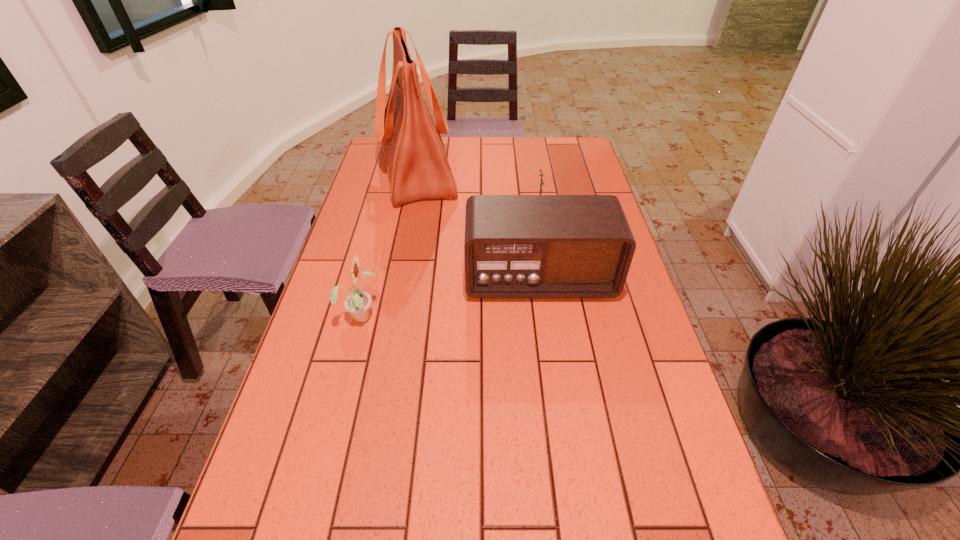
In the image, there is a desktop. Identify the location of free space at the far left corner. Image resolution: width=960 pixels, height=540 pixels. (379, 152).

This screenshot has height=540, width=960. I want to click on free spot between the shopping bag and the left sunflower, so click(389, 243).

The width and height of the screenshot is (960, 540). In order to click on free point between the farther sunflower and the tallest object in this screenshot , I will do `click(477, 194)`.

Where is `free area in between the nearer sunflower and the second farthest object`? free area in between the nearer sunflower and the second farthest object is located at coordinates (449, 266).

The image size is (960, 540). I want to click on free spot between the left sunflower and the right sunflower, so click(x=449, y=266).

At what (x,y) coordinates should I click in order to perform the action: click on vacant space in between the right sunflower and the shopping bag. Please return your answer as a coordinate pair (x, y). Looking at the image, I should click on (477, 194).

Locate which object is the closest to the left sunflower. Please provide its 2D coordinates. Your answer should be formatted as a tuple, i.e. [(x, y)], where the tuple contains the x and y coordinates of a point satisfying the conditions above.

[(516, 246)]

Identify the location of the second closest object to the radio receiver. The width and height of the screenshot is (960, 540). (358, 303).

At what (x,y) coordinates should I click in order to perform the action: click on vacant position in the image that satisfies the following two spatial constraints: 1. on the front-facing side of the radio receiver; 2. on the front-facing side of the left sunflower. Please return your answer as a coordinate pair (x, y). Looking at the image, I should click on (544, 315).

The image size is (960, 540). Find the location of `free space in the image that satisfies the following two spatial constraints: 1. on the face of the farther sunflower; 2. on the front-facing side of the radio receiver`. free space in the image that satisfies the following two spatial constraints: 1. on the face of the farther sunflower; 2. on the front-facing side of the radio receiver is located at coordinates (547, 279).